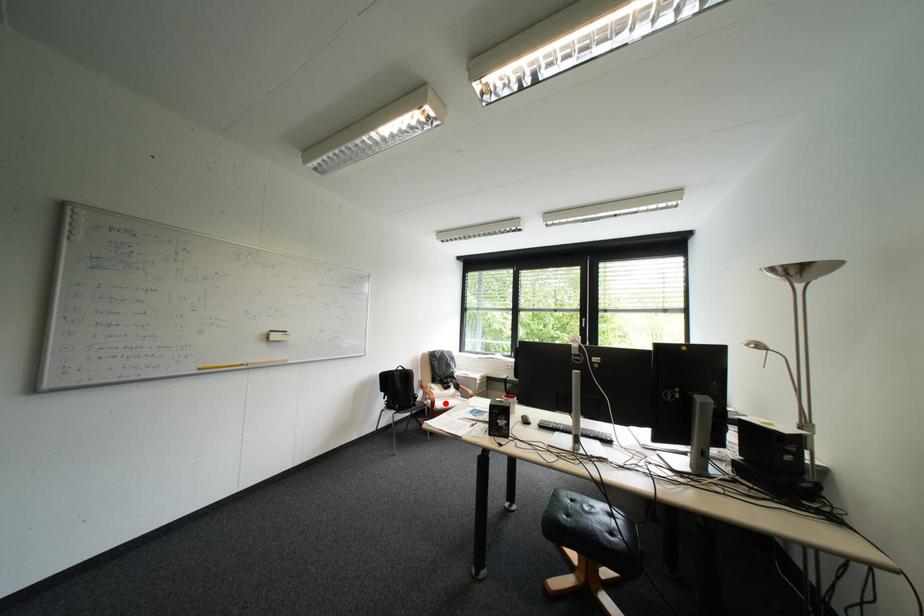
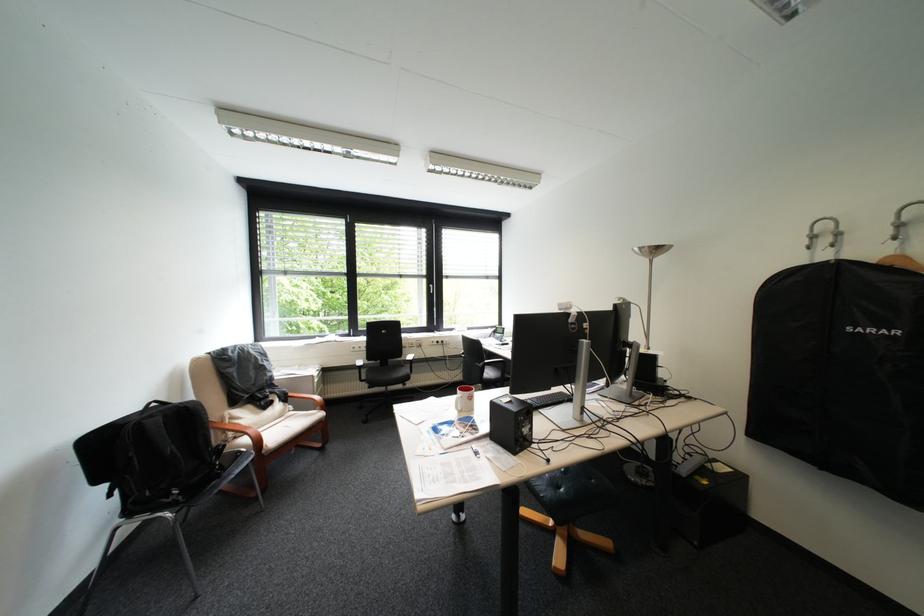
The point at the highlighted location is marked in the first image. Where is the corresponding point in the second image?

(271, 443)